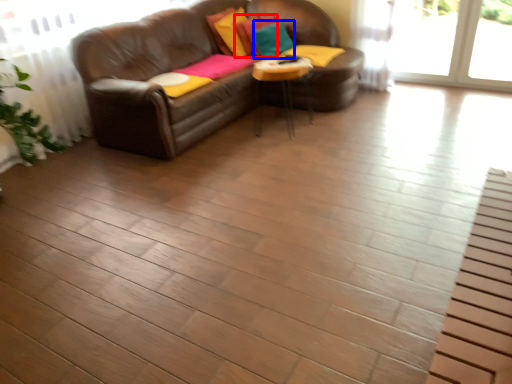
Question: Among these objects, which one is farthest to the camera, pillow (highlighted by a red box) or pillow (highlighted by a blue box)?

Choices:
 (A) pillow
 (B) pillow

Answer: (A)